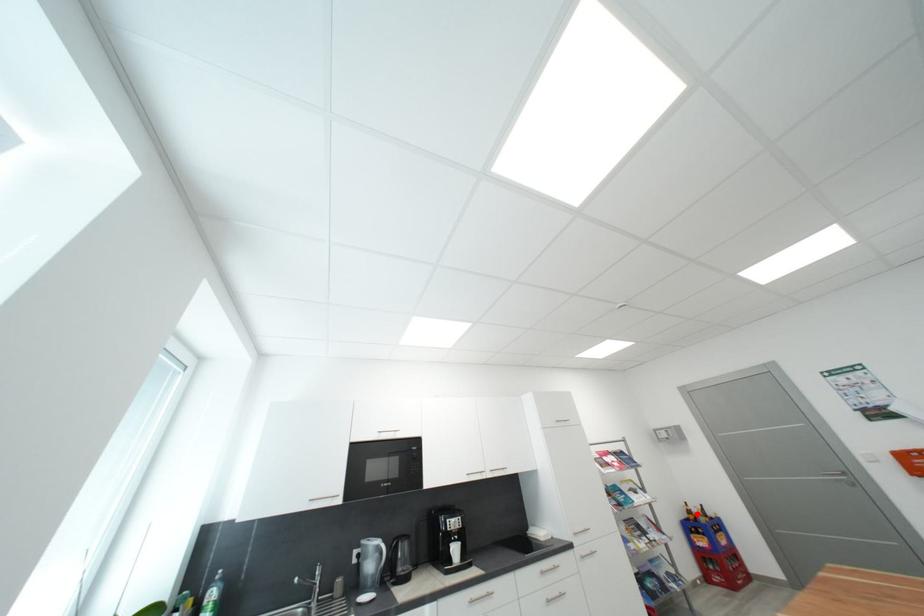
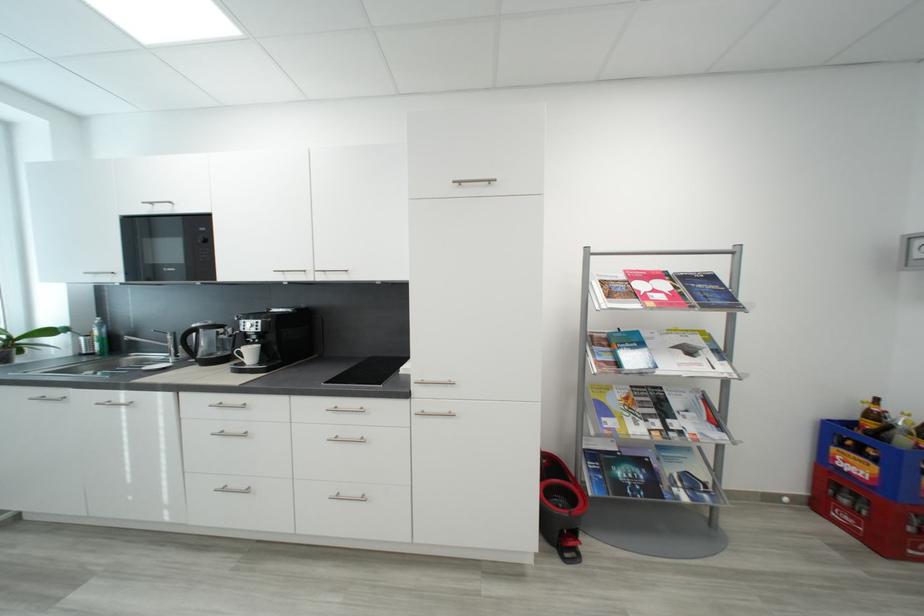
Question: I am providing you with two images of the same scene from different viewpoints. Given a red point in image1, look at the same physical point in image2. Is it:

Choices:
 (A) Closer to the viewpoint
 (B) Farther from the viewpoint

Answer: (A)